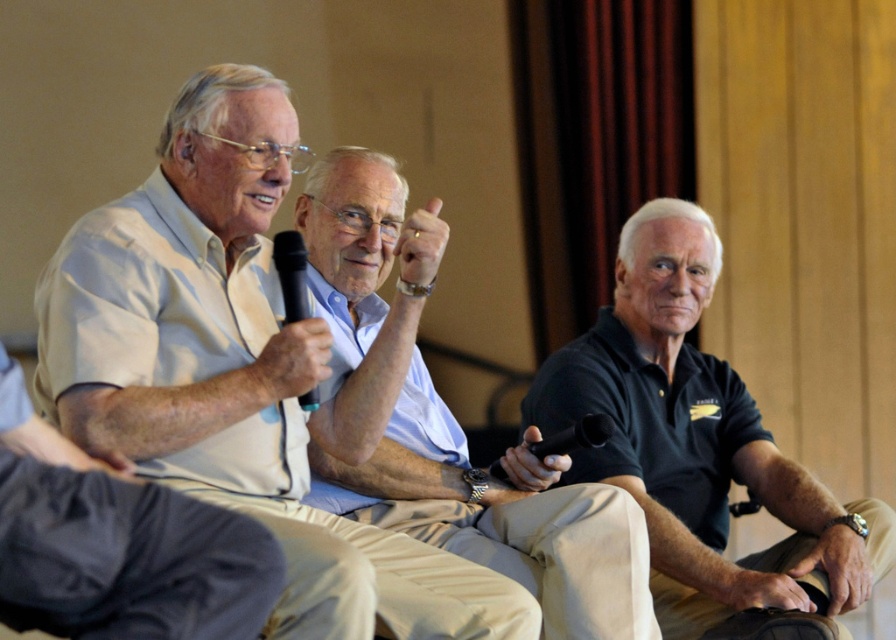
Question: Is leather wristwatch at lower right to the left of matte gold ring at upper center from the viewer's perspective?

Choices:
 (A) yes
 (B) no

Answer: (B)

Question: Which point is farther from the camera taking this photo?

Choices:
 (A) 825,531
 (B) 553,419

Answer: (B)

Question: Does light blue shirt at center appear on the left side of matte gold ring at upper center?

Choices:
 (A) no
 (B) yes

Answer: (B)

Question: Among these objects, which one is nearest to the camera?

Choices:
 (A) black matte polo shirt at right
 (B) light beige shirt at left
 (C) leather at center
 (D) light blue shirt at center

Answer: (B)

Question: Which of the following is the farthest from the observer?

Choices:
 (A) (806, 588)
 (B) (340, 506)
 (C) (429, 260)

Answer: (A)

Question: Can you confirm if light blue shirt at center is thinner than matte gold ring at upper center?

Choices:
 (A) yes
 (B) no

Answer: (B)